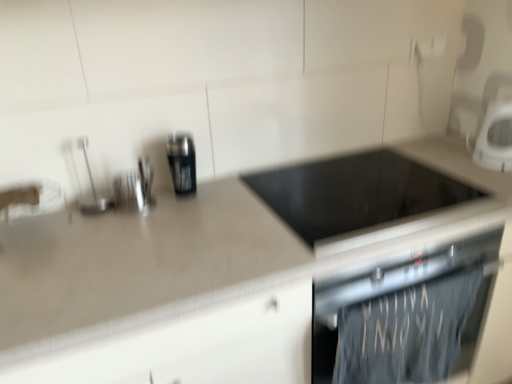
Question: Is black glass cooktop at center, the first appliance viewed from the right, positioned behind white glossy microwave at upper right, placed as the second kitchen appliance when sorted from left to right?

Choices:
 (A) no
 (B) yes

Answer: (A)

Question: From the image's perspective, is black glass cooktop at center, positioned as the third appliance in left-to-right order, on white glossy microwave at upper right, placed as the second kitchen appliance when sorted from left to right?

Choices:
 (A) yes
 (B) no

Answer: (B)

Question: Is black glass cooktop at center, the first appliance viewed from the right, not inside white glossy microwave at upper right, which is the 1th kitchen appliance from right to left?

Choices:
 (A) yes
 (B) no

Answer: (A)

Question: Is black glass cooktop at center, positioned as the third appliance in left-to-right order, bigger than white glossy microwave at upper right, placed as the second kitchen appliance when sorted from left to right?

Choices:
 (A) no
 (B) yes

Answer: (B)

Question: From the image's perspective, does black glass cooktop at center, the first appliance viewed from the right, appear lower than white glossy microwave at upper right, which is the 1th kitchen appliance from right to left?

Choices:
 (A) yes
 (B) no

Answer: (A)

Question: Choose the correct answer: Is brushed metal utensil holder at upper left, which appears as the 2th appliance when viewed from the left, inside brushed metal spoon at upper left, the 3th appliance in the right-to-left sequence, or outside it?

Choices:
 (A) outside
 (B) inside

Answer: (A)

Question: Is point (117, 178) positioned closer to the camera than point (93, 206)?

Choices:
 (A) closer
 (B) farther

Answer: (B)

Question: Considering the relative positions of brushed metal utensil holder at upper left, which appears as the 2th appliance when viewed from the left, and brushed metal spoon at upper left, the 3th appliance in the right-to-left sequence, in the image provided, is brushed metal utensil holder at upper left, which appears as the 2th appliance when viewed from the left, to the left or to the right of brushed metal spoon at upper left, the 3th appliance in the right-to-left sequence,?

Choices:
 (A) right
 (B) left

Answer: (A)

Question: From their relative heights in the image, would you say brushed metal utensil holder at upper left, which appears as the 2th appliance when viewed from the left, is taller or shorter than brushed metal spoon at upper left, the 3th appliance in the right-to-left sequence?

Choices:
 (A) tall
 (B) short

Answer: (B)

Question: Looking at their shapes, would you say metallic can at center, arranged as the 1th kitchen appliance when viewed from the left, is wider or thinner than brushed metal utensil holder at upper left, the 2th appliance viewed from the right?

Choices:
 (A) thin
 (B) wide

Answer: (A)

Question: From a real-world perspective, is metallic can at center, arranged as the 1th kitchen appliance when viewed from the left, above or below brushed metal utensil holder at upper left, which appears as the 2th appliance when viewed from the left?

Choices:
 (A) above
 (B) below

Answer: (B)

Question: In the image, is metallic can at center, arranged as the 1th kitchen appliance when viewed from the left, on the left side or the right side of brushed metal utensil holder at upper left, the 2th appliance viewed from the right?

Choices:
 (A) right
 (B) left

Answer: (A)

Question: From their relative heights in the image, would you say metallic can at center, arranged as the 1th kitchen appliance when viewed from the left, is taller or shorter than brushed metal utensil holder at upper left, which appears as the 2th appliance when viewed from the left?

Choices:
 (A) tall
 (B) short

Answer: (A)

Question: Do you think white glossy microwave at upper right, which is the 1th kitchen appliance from right to left, is within metallic can at center, arranged as the 1th kitchen appliance when viewed from the left, or outside of it?

Choices:
 (A) inside
 (B) outside

Answer: (B)

Question: Considering the positions of white glossy microwave at upper right, placed as the second kitchen appliance when sorted from left to right, and metallic can at center, the 2th kitchen appliance from the right, in the image, is white glossy microwave at upper right, placed as the second kitchen appliance when sorted from left to right, taller or shorter than metallic can at center, the 2th kitchen appliance from the right,?

Choices:
 (A) short
 (B) tall

Answer: (B)